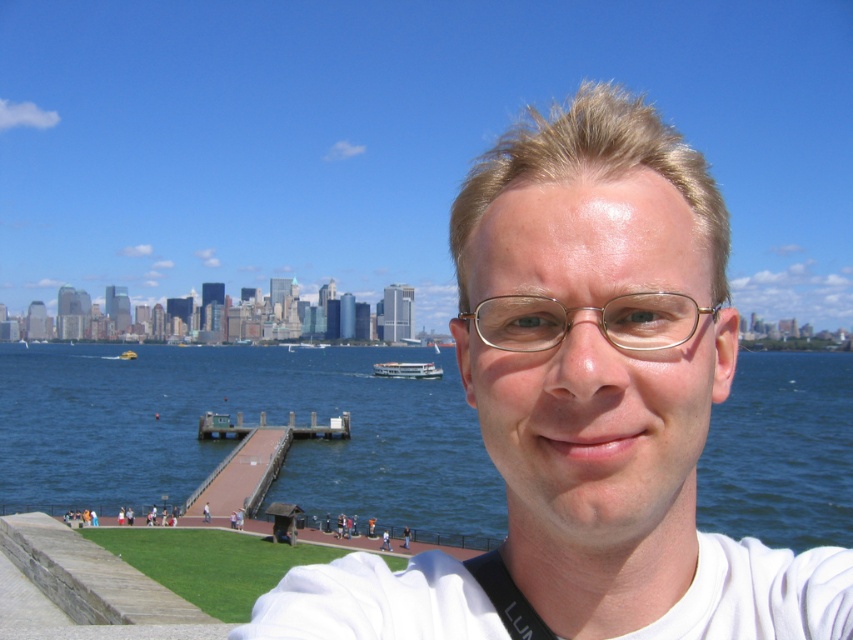
Question: Among these objects, which one is farthest from the camera?

Choices:
 (A) blue water at center
 (B) white matte shirt at center
 (C) white glossy boat at center
 (D) gold metallic glasses at center

Answer: (C)

Question: Is blue water at center wider than gold metallic glasses at center?

Choices:
 (A) no
 (B) yes

Answer: (B)

Question: Can you confirm if blue water at center is bigger than white glossy boat at center?

Choices:
 (A) no
 (B) yes

Answer: (B)

Question: Which point is closer to the camera?

Choices:
 (A) white glossy boat at center
 (B) white matte shirt at center
 (C) blue water at center

Answer: (B)

Question: Estimate the real-world distances between objects in this image. Which object is farther from the white glossy boat at center?

Choices:
 (A) blue water at center
 (B) gold metallic glasses at center

Answer: (B)

Question: Does white matte shirt at center have a greater width compared to gold metallic glasses at center?

Choices:
 (A) yes
 (B) no

Answer: (A)